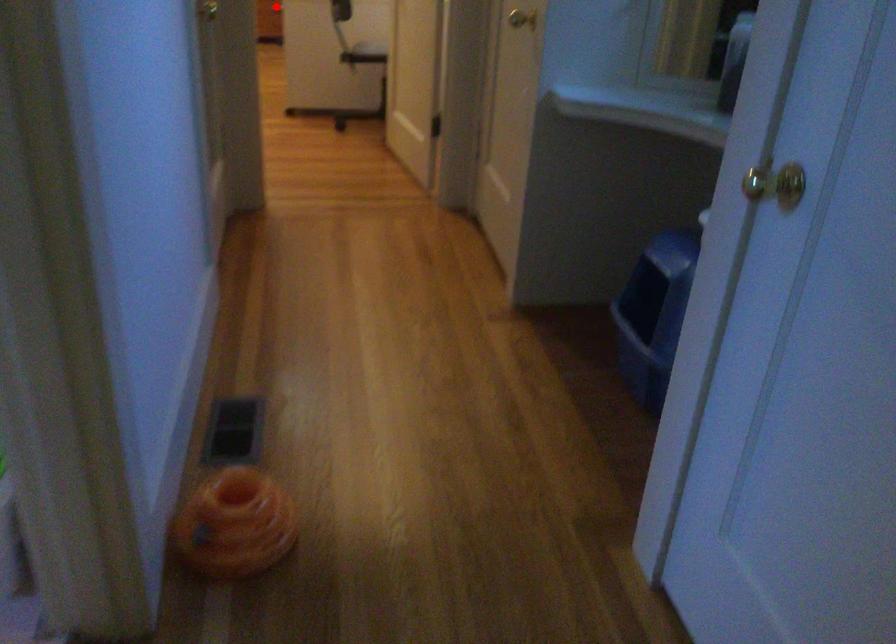
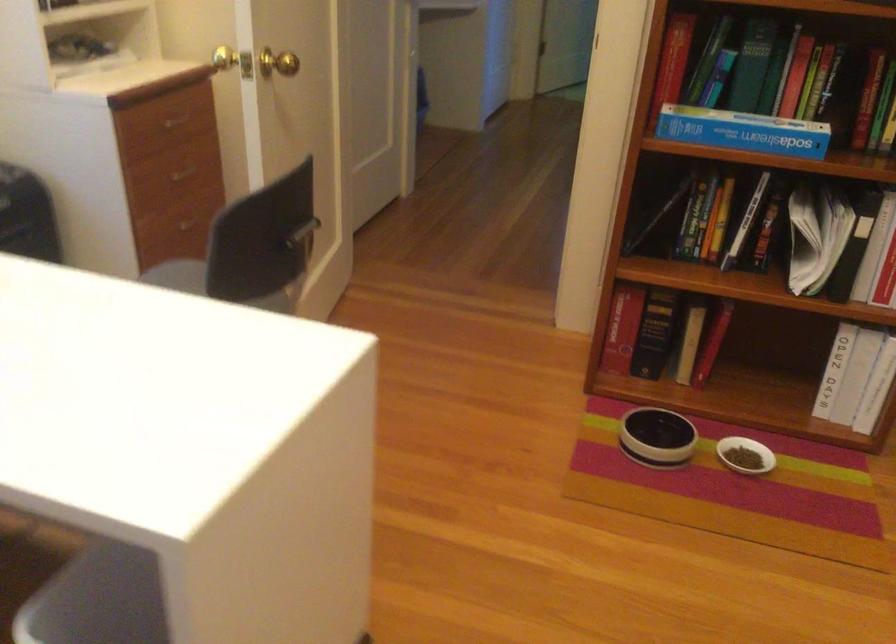
Question: I am providing you with two images of the same scene from different viewpoints. A red point is marked on the first image. Can you still see the location of the red point in image 2?

Choices:
 (A) Yes
 (B) No

Answer: (B)